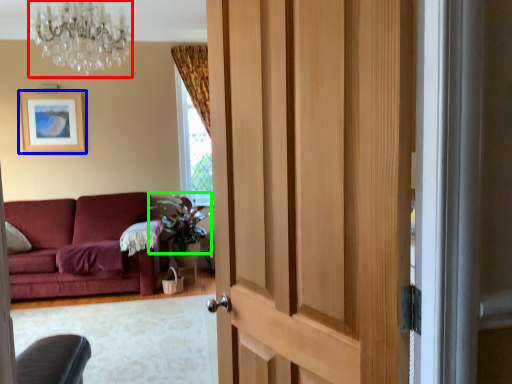
Question: Considering the real-world distances, which object is farthest from chandelier (highlighted by a red box)? picture frame (highlighted by a blue box) or plant (highlighted by a green box)?

Choices:
 (A) picture frame
 (B) plant

Answer: (A)